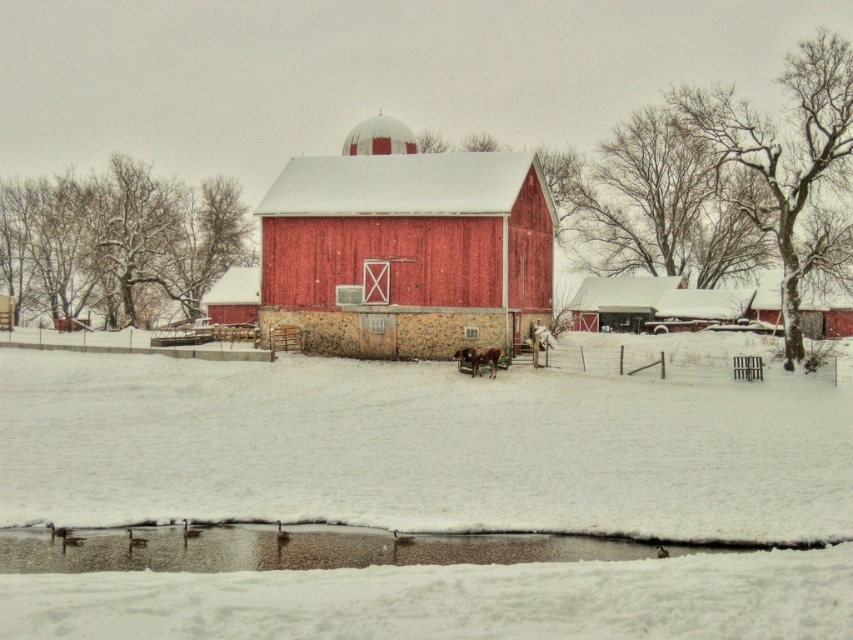
Between matte wood barn at center and brown muddy puddle at lower center, which one is positioned lower?

brown muddy puddle at lower center is lower down.

Can you confirm if matte wood barn at center is positioned to the right of brown muddy puddle at lower center?

In fact, matte wood barn at center is to the left of brown muddy puddle at lower center.

Is point (341, 260) closer to camera compared to point (155, 556)?

No, (341, 260) is further to viewer.

Find the location of a particular element. This screenshot has width=853, height=640. matte wood barn at center is located at coordinates (405, 246).

Between brown muddy puddle at lower center and brown fuzzy cow at center, which one appears on the left side from the viewer's perspective?

brown muddy puddle at lower center is more to the left.

Between brown muddy puddle at lower center and brown fuzzy cow at center, which one is positioned lower?

brown muddy puddle at lower center is below.

Who is more forward, (148, 561) or (492, 372)?

Positioned in front is point (148, 561).

Where is `brown muddy puddle at lower center`? The height and width of the screenshot is (640, 853). brown muddy puddle at lower center is located at coordinates (328, 547).

Is the position of white fluffy snow at center more distant than that of matte wood barn at center?

No, white fluffy snow at center is in front of matte wood barn at center.

Is point (321, 420) more distant than point (300, 248)?

No, it is in front of (300, 248).

Which is behind, point (840, 637) or point (515, 225)?

Point (515, 225)

Locate an element on the screen. The width and height of the screenshot is (853, 640). white fluffy snow at center is located at coordinates (419, 445).